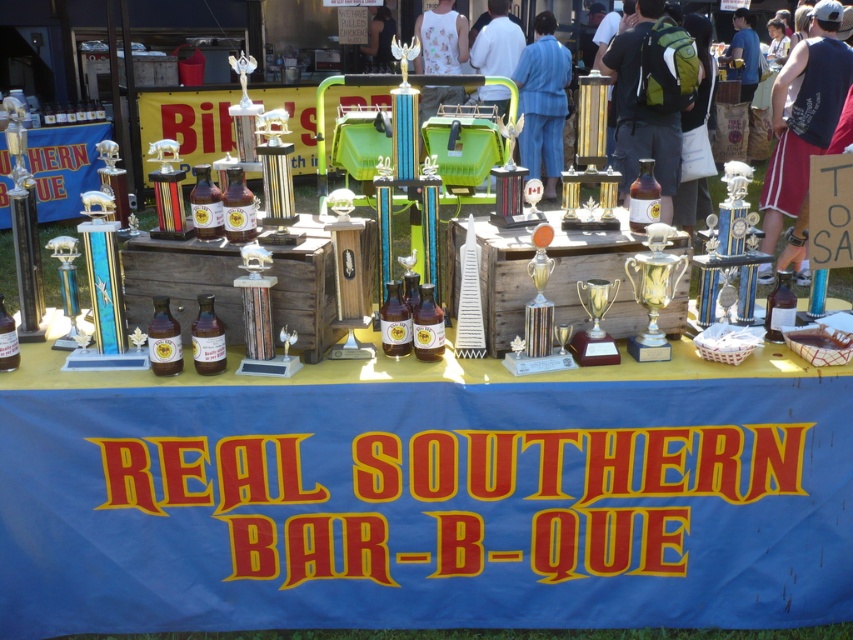
Does wooden chest at center have a greater width compared to gold shiny trophy at center?

Indeed, wooden chest at center has a greater width compared to gold shiny trophy at center.

Does point (212, 250) come in front of point (646, 237)?

No, (212, 250) is behind (646, 237).

What do you see at coordinates (183, 280) in the screenshot? I see `wooden chest at center` at bounding box center [183, 280].

Where is `wooden chest at center`? The image size is (853, 640). wooden chest at center is located at coordinates (183, 280).

Does blue cotton tank top at upper right have a greater height compared to gold shiny trophy at center?

Indeed, blue cotton tank top at upper right has a greater height compared to gold shiny trophy at center.

Who is higher up, blue cotton tank top at upper right or gold shiny trophy at center?

Positioned higher is blue cotton tank top at upper right.

Who is more distant from viewer, (x=764, y=252) or (x=660, y=244)?

Positioned behind is point (x=764, y=252).

In order to click on blue cotton tank top at upper right in this screenshot , I will do `click(804, 115)`.

Does blue cotton tank top at upper right come behind blue shirt at upper right?

That is False.

Where is `blue cotton tank top at upper right`? blue cotton tank top at upper right is located at coordinates (x=804, y=115).

Find the location of a particular element. blue cotton tank top at upper right is located at coordinates pos(804,115).